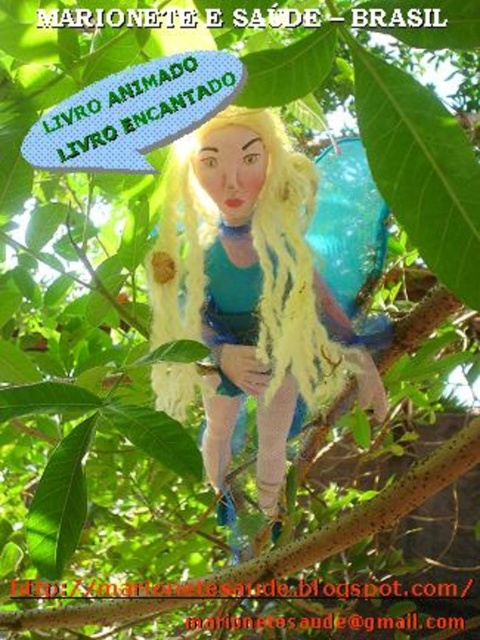
Question: Where is fuzzy fabric doll at center located in relation to brown rough tree branch at center in the image?

Choices:
 (A) below
 (B) above

Answer: (B)

Question: Which point is farther to the camera?

Choices:
 (A) fuzzy fabric doll at center
 (B) brown rough tree branch at center

Answer: (B)

Question: Which point is farther from the camera taking this photo?

Choices:
 (A) (358, 518)
 (B) (283, 344)

Answer: (A)

Question: Is fuzzy fabric doll at center further to the viewer compared to brown rough tree branch at center?

Choices:
 (A) no
 (B) yes

Answer: (A)

Question: Is fuzzy fabric doll at center bigger than brown rough tree branch at center?

Choices:
 (A) no
 (B) yes

Answer: (A)